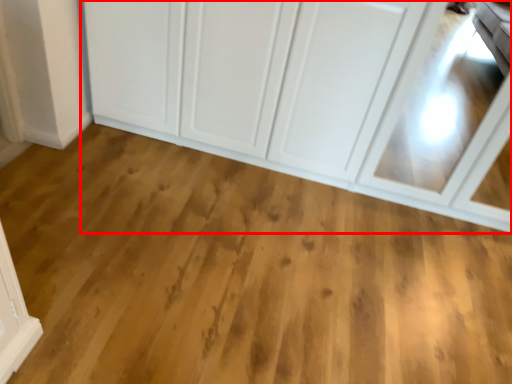
Question: Observing the image, what is the correct spatial positioning of cupboard (annotated by the red box) in reference to plain?

Choices:
 (A) right
 (B) left

Answer: (A)